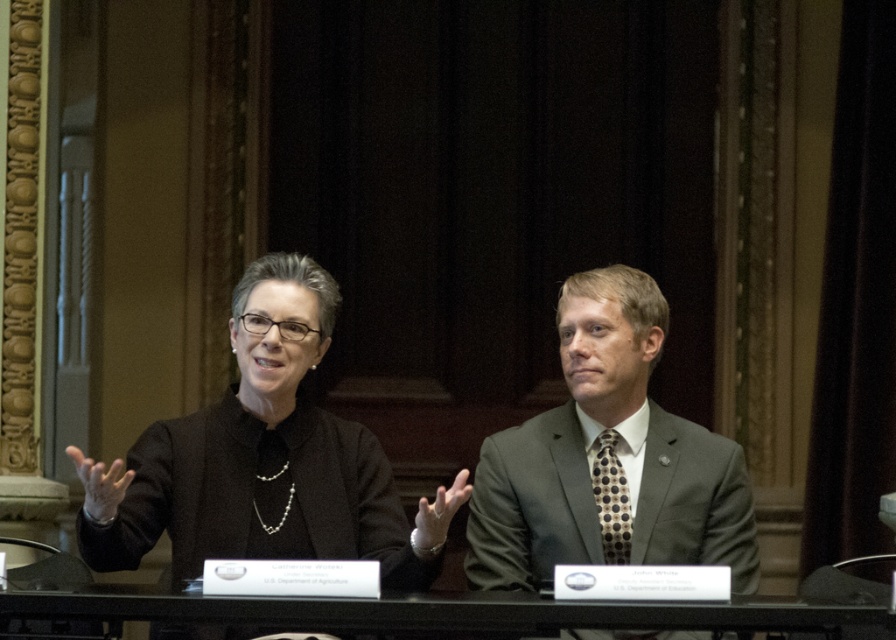
Question: Does black matte blazer at center have a lesser width compared to dark gray suit at center?

Choices:
 (A) no
 (B) yes

Answer: (A)

Question: Which of the following is the farthest from the observer?

Choices:
 (A) black glass table at center
 (B) black matte blazer at center

Answer: (B)

Question: Considering the relative positions of black matte blazer at center and black glass table at center in the image provided, where is black matte blazer at center located with respect to black glass table at center?

Choices:
 (A) right
 (B) left

Answer: (B)

Question: Which point is farther to the camera?

Choices:
 (A) (608, 614)
 (B) (102, 552)

Answer: (B)

Question: Estimate the real-world distances between objects in this image. Which object is closer to the black glass table at center?

Choices:
 (A) dark gray suit at center
 (B) black matte blazer at center

Answer: (B)

Question: Can you confirm if dark gray suit at center is bigger than black glass table at center?

Choices:
 (A) yes
 (B) no

Answer: (A)